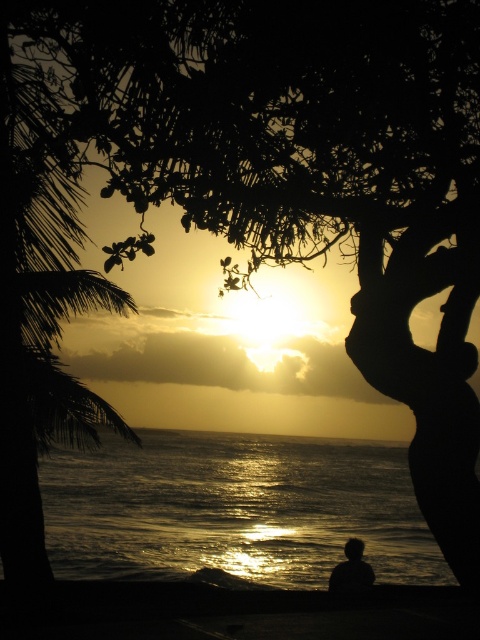
Does silky black palm tree at left appear under silhouette figure at center?

Incorrect, silky black palm tree at left is not positioned below silhouette figure at center.

Which is in front, point (100, 275) or point (338, 572)?

Point (338, 572)

Who is more forward, (87, 292) or (359, 554)?

Point (87, 292)

This screenshot has width=480, height=640. What are the coordinates of `silky black palm tree at left` in the screenshot? It's located at (38, 307).